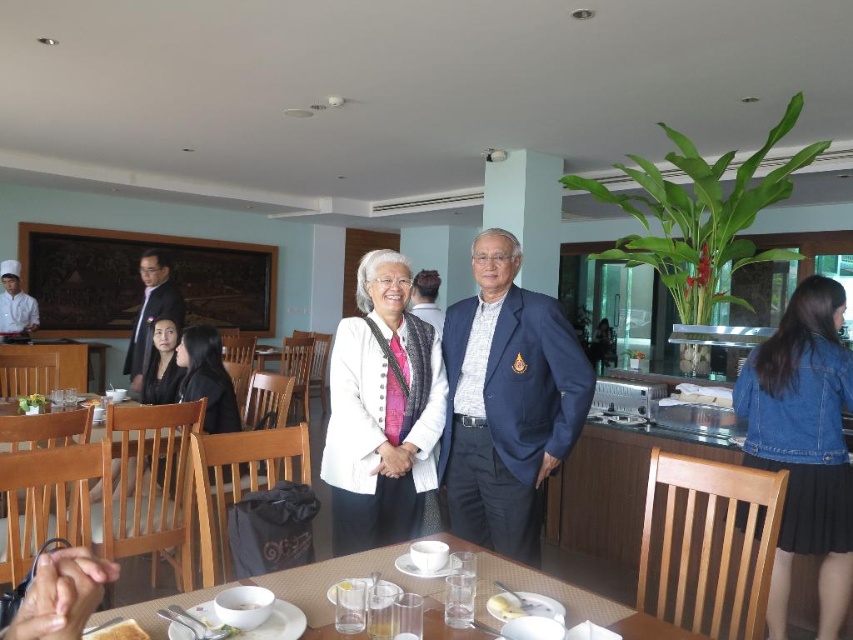
Is navy blue suit at center taller than dark blue suit at center?

Yes, navy blue suit at center is taller than dark blue suit at center.

Describe the element at coordinates (506, 403) in the screenshot. I see `navy blue suit at center` at that location.

What are the coordinates of `navy blue suit at center` in the screenshot? It's located at (506, 403).

Which is below, white textured sweater at center or matte white chef's uniform at left?

white textured sweater at center

Who is positioned more to the left, white textured sweater at center or matte white chef's uniform at left?

matte white chef's uniform at left

Is point (360, 540) positioned before point (18, 285)?

Yes.

Where is `white textured sweater at center`? white textured sweater at center is located at coordinates (381, 412).

Is denim jacket at lower right closer to the viewer compared to dark blue suit at center?

That is True.

Is point (846, 513) closer to viewer compared to point (131, 365)?

Yes, point (846, 513) is closer to viewer.

Who is more forward, (x=746, y=445) or (x=132, y=388)?

Point (x=746, y=445)

The height and width of the screenshot is (640, 853). Identify the location of denim jacket at lower right. (804, 444).